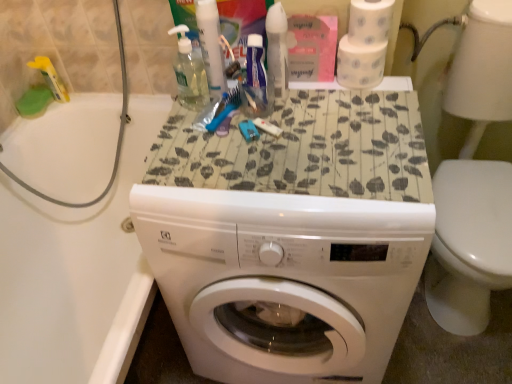
What is the approximate width of white glossy washing machine at center?

The width of white glossy washing machine at center is 23.18 inches.

In order to face white glossy bathtub at left, should I rotate leftwards or rightwards?

You should look left and rotate roughly 20.460 degrees.

The width and height of the screenshot is (512, 384). What do you see at coordinates (189, 72) in the screenshot? I see `transparent liquid soap at upper center, the second cleaning product in the right-to-left sequence` at bounding box center [189, 72].

At what (x,y) coordinates should I click in order to perform the action: click on transparent liquid soap at upper center, the 1th cleaning product when ordered from left to right. Please return your answer as a coordinate pair (x, y). Looking at the image, I should click on (189, 72).

Find the location of a particular element. This screenshot has height=384, width=512. white textured toilet paper at upper right, which is counted as the 1th toilet paper, starting from the top is located at coordinates (369, 21).

I want to click on white glossy washer at lower right, so click(474, 180).

Image resolution: width=512 pixels, height=384 pixels. I want to click on bath that is behind the white glossy washing machine at center, so pyautogui.click(x=74, y=272).

How many degrees apart are the facing directions of white glossy bathtub at left and white glossy washing machine at center?

91.2 degrees separate the facing orientations of white glossy bathtub at left and white glossy washing machine at center.

Which of these two, white glossy bathtub at left or white glossy washing machine at center, is bigger?

Bigger between the two is white glossy bathtub at left.

Looking at this image, from a real-world perspective, is white glossy bathtub at left beneath white glossy washing machine at center?

Yes, from a real-world perspective, white glossy bathtub at left is under white glossy washing machine at center.

Is white textured toilet paper at upper right, which is the first toilet paper from bottom to top, positioned with its back to transparent liquid soap at upper center, the second cleaning product in the right-to-left sequence?

That's not correct — white textured toilet paper at upper right, which is the first toilet paper from bottom to top, is not looking away from transparent liquid soap at upper center, the second cleaning product in the right-to-left sequence.

From the image's perspective, is white textured toilet paper at upper right, the 2th toilet paper when ordered from top to bottom, on transparent liquid soap at upper center, the second cleaning product in the right-to-left sequence?

Yes, from the image's perspective, white textured toilet paper at upper right, the 2th toilet paper when ordered from top to bottom, is over transparent liquid soap at upper center, the second cleaning product in the right-to-left sequence.

Where is `toilet paper located underneath the transparent liquid soap at upper center, the second cleaning product in the right-to-left sequence (from a real-world perspective)`? Image resolution: width=512 pixels, height=384 pixels. toilet paper located underneath the transparent liquid soap at upper center, the second cleaning product in the right-to-left sequence (from a real-world perspective) is located at coordinates (364, 44).

Is white textured toilet paper at upper right, which is the first toilet paper from bottom to top, next to transparent liquid soap at upper center, the second cleaning product in the right-to-left sequence, and touching it?

No, white textured toilet paper at upper right, which is the first toilet paper from bottom to top, is not beside transparent liquid soap at upper center, the second cleaning product in the right-to-left sequence.

Can you confirm if white textured toilet paper at upper right, the 2th toilet paper when ordered from bottom to top, is shorter than translucent plastic spray bottle at upper center, marked as the 1th cleaning product in a right-to-left arrangement?

Yes, white textured toilet paper at upper right, the 2th toilet paper when ordered from bottom to top, is shorter than translucent plastic spray bottle at upper center, marked as the 1th cleaning product in a right-to-left arrangement.

Which of these two, white textured toilet paper at upper right, which is counted as the 1th toilet paper, starting from the top, or translucent plastic spray bottle at upper center, marked as the 1th cleaning product in a right-to-left arrangement, is thinner?

translucent plastic spray bottle at upper center, marked as the 1th cleaning product in a right-to-left arrangement, is thinner.

Which is nearer, (x=374, y=12) or (x=277, y=79)?

Clearly, point (x=374, y=12) is closer to the camera than point (x=277, y=79).

What's the angular difference between white textured toilet paper at upper right, which is counted as the 1th toilet paper, starting from the top, and translucent plastic spray bottle at upper center, marked as the 1th cleaning product in a right-to-left arrangement,'s facing directions?

The angular difference between white textured toilet paper at upper right, which is counted as the 1th toilet paper, starting from the top, and translucent plastic spray bottle at upper center, marked as the 1th cleaning product in a right-to-left arrangement, is 2.92 degrees.

Is translucent plastic toothpaste tube at upper center, the 1th toiletry positioned from the front, facing away from white glossy washer at lower right?

No.

How distant is translucent plastic toothpaste tube at upper center, placed as the 1th toiletry when sorted from right to left, from white glossy washer at lower right?

33.16 inches.

Based on the photo, is translucent plastic toothpaste tube at upper center, arranged as the 2th toiletry when viewed from the back, in front of white glossy washer at lower right?

No, translucent plastic toothpaste tube at upper center, arranged as the 2th toiletry when viewed from the back, is further to the viewer.

Are translucent plastic toothpaste tube at upper center, arranged as the 2th toiletry when viewed from the back, and white glossy washer at lower right located far from each other?

No, there isn't a large distance between translucent plastic toothpaste tube at upper center, arranged as the 2th toiletry when viewed from the back, and white glossy washer at lower right.

Does yellow plastic bottle at upper left, the first toiletry in the back-to-front sequence, turn towards translucent plastic toothpaste tube at upper center, the 1th toiletry positioned from the front?

No, yellow plastic bottle at upper left, the first toiletry in the back-to-front sequence, is not facing towards translucent plastic toothpaste tube at upper center, the 1th toiletry positioned from the front.

Is yellow plastic bottle at upper left, the first toiletry in the back-to-front sequence, inside the boundaries of translucent plastic toothpaste tube at upper center, the 1th toiletry positioned from the front, or outside?

yellow plastic bottle at upper left, the first toiletry in the back-to-front sequence, cannot be found inside translucent plastic toothpaste tube at upper center, the 1th toiletry positioned from the front.

In the scene shown: Which object is positioned more to the left, yellow plastic bottle at upper left, which ranks as the second toiletry in front-to-back order, or translucent plastic toothpaste tube at upper center, placed as the 1th toiletry when sorted from right to left?

From the viewer's perspective, yellow plastic bottle at upper left, which ranks as the second toiletry in front-to-back order, appears more on the left side.

Is yellow plastic bottle at upper left, which is counted as the 1th toiletry, starting from the left, positioned in front of translucent plastic toothpaste tube at upper center, placed as the 1th toiletry when sorted from right to left?

No, yellow plastic bottle at upper left, which is counted as the 1th toiletry, starting from the left, is further to the viewer.

Can we say yellow plastic bottle at upper left, which ranks as the second toiletry in front-to-back order, lies outside translucent plastic spray bottle at upper center, which is the second cleaning product from left to right?

Yes.

Is yellow plastic bottle at upper left, which ranks as the second toiletry in front-to-back order, positioned far away from translucent plastic spray bottle at upper center, marked as the 1th cleaning product in a right-to-left arrangement?

No, there isn't a large distance between yellow plastic bottle at upper left, which ranks as the second toiletry in front-to-back order, and translucent plastic spray bottle at upper center, marked as the 1th cleaning product in a right-to-left arrangement.

Does yellow plastic bottle at upper left, the first toiletry in the back-to-front sequence, have a lesser width compared to translucent plastic spray bottle at upper center, marked as the 1th cleaning product in a right-to-left arrangement?

In fact, yellow plastic bottle at upper left, the first toiletry in the back-to-front sequence, might be wider than translucent plastic spray bottle at upper center, marked as the 1th cleaning product in a right-to-left arrangement.

Considering the relative positions of yellow plastic bottle at upper left, the first toiletry in the back-to-front sequence, and translucent plastic spray bottle at upper center, marked as the 1th cleaning product in a right-to-left arrangement, in the image provided, is yellow plastic bottle at upper left, the first toiletry in the back-to-front sequence, to the right of translucent plastic spray bottle at upper center, marked as the 1th cleaning product in a right-to-left arrangement, from the viewer's perspective?

Incorrect, yellow plastic bottle at upper left, the first toiletry in the back-to-front sequence, is not on the right side of translucent plastic spray bottle at upper center, marked as the 1th cleaning product in a right-to-left arrangement.

Which object is closer to the camera taking this photo, translucent plastic spray bottle at upper center, which is the second cleaning product from left to right, or translucent plastic toothpaste tube at upper center, placed as the second toiletry when sorted from left to right?

Positioned in front is translucent plastic spray bottle at upper center, which is the second cleaning product from left to right.

Is translucent plastic spray bottle at upper center, which is the second cleaning product from left to right, far from translucent plastic toothpaste tube at upper center, arranged as the 2th toiletry when viewed from the back?

No, translucent plastic spray bottle at upper center, which is the second cleaning product from left to right, is not far from translucent plastic toothpaste tube at upper center, arranged as the 2th toiletry when viewed from the back.

Which object is positioned more to the left, translucent plastic spray bottle at upper center, marked as the 1th cleaning product in a right-to-left arrangement, or translucent plastic toothpaste tube at upper center, placed as the 1th toiletry when sorted from right to left?

translucent plastic toothpaste tube at upper center, placed as the 1th toiletry when sorted from right to left.

Can you confirm if translucent plastic spray bottle at upper center, which is the second cleaning product from left to right, is bigger than translucent plastic toothpaste tube at upper center, arranged as the 2th toiletry when viewed from the back?

No, translucent plastic spray bottle at upper center, which is the second cleaning product from left to right, is not bigger than translucent plastic toothpaste tube at upper center, arranged as the 2th toiletry when viewed from the back.

Identify the location of washing machine above the white glossy bathtub at left (from a real-world perspective). The height and width of the screenshot is (384, 512). (283, 279).

At what (x,y) coordinates should I click in order to perform the action: click on toilet paper directly beneath the transparent liquid soap at upper center, the second cleaning product in the right-to-left sequence (from a real-world perspective). Please return your answer as a coordinate pair (x, y). The height and width of the screenshot is (384, 512). Looking at the image, I should click on (364, 44).

Which object lies nearer to the anchor point yellow plastic bottle at upper left, the first toiletry in the back-to-front sequence, translucent plastic spray bottle at upper center, marked as the 1th cleaning product in a right-to-left arrangement, or white textured toilet paper at upper right, which is counted as the 1th toilet paper, starting from the top?

translucent plastic spray bottle at upper center, marked as the 1th cleaning product in a right-to-left arrangement, is positioned closer to the anchor yellow plastic bottle at upper left, the first toiletry in the back-to-front sequence.

Looking at the image, which one is located closer to white glossy washer at lower right, white textured toilet paper at upper right, the 2th toilet paper when ordered from top to bottom, or transparent liquid soap at upper center, the 1th cleaning product when ordered from left to right?

white textured toilet paper at upper right, the 2th toilet paper when ordered from top to bottom, is closer to white glossy washer at lower right.

Which object lies nearer to the anchor point translucent plastic toothpaste tube at upper center, placed as the second toiletry when sorted from left to right, white glossy washing machine at center or yellow plastic bottle at upper left, the 2th toiletry from the right?

white glossy washing machine at center is closer to translucent plastic toothpaste tube at upper center, placed as the second toiletry when sorted from left to right.

Looking at the image, which one is located further to white glossy washing machine at center, white glossy bathtub at left or white textured toilet paper at upper right, which is the first toilet paper from bottom to top?

The object further to white glossy washing machine at center is white glossy bathtub at left.

Estimate the real-world distances between objects in this image. Which object is closer to white textured toilet paper at upper right, the 2th toilet paper when ordered from top to bottom, translucent plastic spray bottle at upper center, marked as the 1th cleaning product in a right-to-left arrangement, or yellow plastic bottle at upper left, which ranks as the second toiletry in front-to-back order?

translucent plastic spray bottle at upper center, marked as the 1th cleaning product in a right-to-left arrangement, lies closer to white textured toilet paper at upper right, the 2th toilet paper when ordered from top to bottom, than the other object.

From the image, which object appears to be farther from white textured toilet paper at upper right, which is the first toilet paper from bottom to top, yellow plastic bottle at upper left, which is counted as the 1th toiletry, starting from the left, or white glossy washing machine at center?

Among the two, yellow plastic bottle at upper left, which is counted as the 1th toiletry, starting from the left, is located further to white textured toilet paper at upper right, which is the first toilet paper from bottom to top.

Estimate the real-world distances between objects in this image. Which object is closer to white textured toilet paper at upper right, which is counted as the 1th toilet paper, starting from the top, yellow plastic bottle at upper left, which is counted as the 1th toiletry, starting from the left, or white glossy bathtub at left?

white glossy bathtub at left is closer to white textured toilet paper at upper right, which is counted as the 1th toilet paper, starting from the top.

Considering their positions, is transparent liquid soap at upper center, the 1th cleaning product when ordered from left to right, positioned closer to translucent plastic toothpaste tube at upper center, the 1th toiletry positioned from the front, than yellow plastic bottle at upper left, the 2th toiletry from the right?

Among the two, transparent liquid soap at upper center, the 1th cleaning product when ordered from left to right, is located nearer to translucent plastic toothpaste tube at upper center, the 1th toiletry positioned from the front.

This screenshot has width=512, height=384. I want to click on cleaning product located between white glossy bathtub at left and translucent plastic spray bottle at upper center, which is the second cleaning product from left to right, in the left-right direction, so click(189, 72).

The width and height of the screenshot is (512, 384). I want to click on cleaning product between yellow plastic bottle at upper left, which ranks as the second toiletry in front-to-back order, and translucent plastic toothpaste tube at upper center, arranged as the 2th toiletry when viewed from the back, so click(189, 72).

Locate an element on the screen. toiletry between yellow plastic bottle at upper left, which is counted as the 1th toiletry, starting from the left, and white textured toilet paper at upper right, the 2th toilet paper when ordered from top to bottom is located at coordinates (211, 46).

Find the location of `bath situated between yellow plastic bottle at upper left, which is counted as the 1th toiletry, starting from the left, and white textured toilet paper at upper right, which is counted as the 1th toilet paper, starting from the top, from left to right`. bath situated between yellow plastic bottle at upper left, which is counted as the 1th toiletry, starting from the left, and white textured toilet paper at upper right, which is counted as the 1th toilet paper, starting from the top, from left to right is located at coordinates (74, 272).